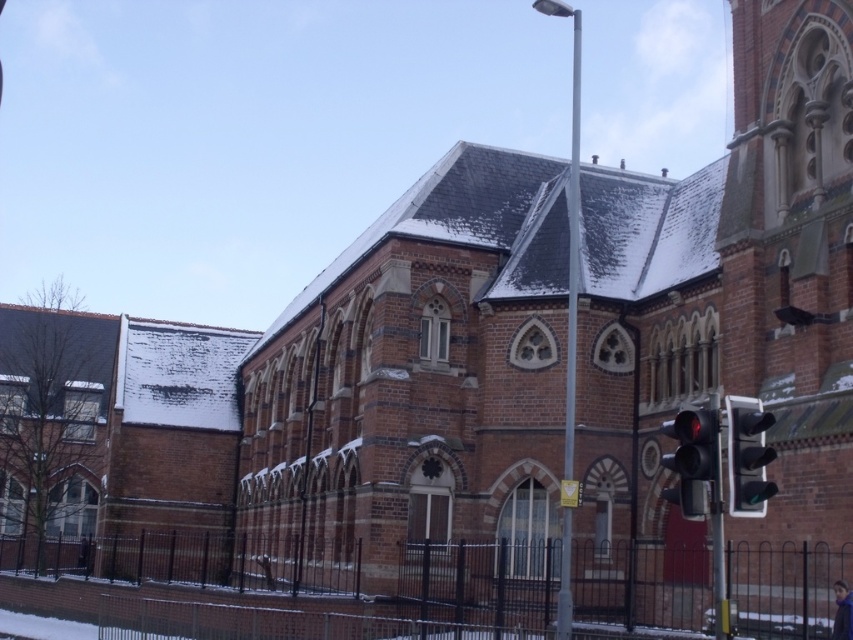
You are standing in front of the historic building and want to cross the street. There is a traffic light at point (693, 461). Is the traffic light red?

The red glass traffic light at lower right is located at point (693, 461), so yes, the traffic light is red.

You are standing in front of the historic building and want to walk towards the two points marked in the image. Which point will you reach first, point (712, 435) or point (761, 429)?

Point (712, 435) is closer to you than point (761, 429), so you will reach point (712, 435) first.